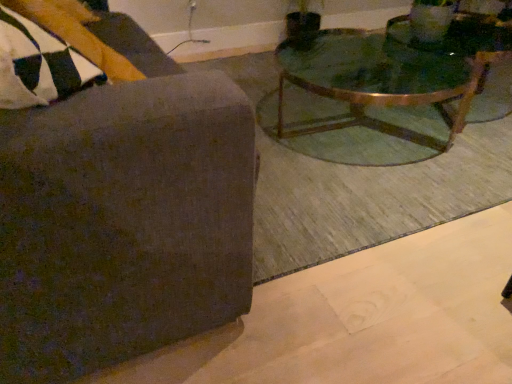
Question: Based on their positions, is green glass coffee table at upper right located to the left or right of dark gray fabric chair at upper left?

Choices:
 (A) left
 (B) right

Answer: (B)

Question: Is green glass coffee table at upper right in front of or behind dark gray fabric chair at upper left in the image?

Choices:
 (A) front
 (B) behind

Answer: (B)

Question: Is green glass coffee table at upper right taller or shorter than dark gray fabric chair at upper left?

Choices:
 (A) tall
 (B) short

Answer: (B)

Question: Considering the positions of point (159, 155) and point (288, 92), is point (159, 155) closer or farther from the camera than point (288, 92)?

Choices:
 (A) farther
 (B) closer

Answer: (B)

Question: From a real-world perspective, is dark gray fabric chair at upper left above or below green glass coffee table at upper right?

Choices:
 (A) above
 (B) below

Answer: (A)

Question: Considering the relative positions of dark gray fabric chair at upper left and green glass coffee table at upper right in the image provided, is dark gray fabric chair at upper left to the left or to the right of green glass coffee table at upper right?

Choices:
 (A) left
 (B) right

Answer: (A)

Question: Considering their positions, is dark gray fabric chair at upper left located in front of or behind green glass coffee table at upper right?

Choices:
 (A) behind
 (B) front

Answer: (B)